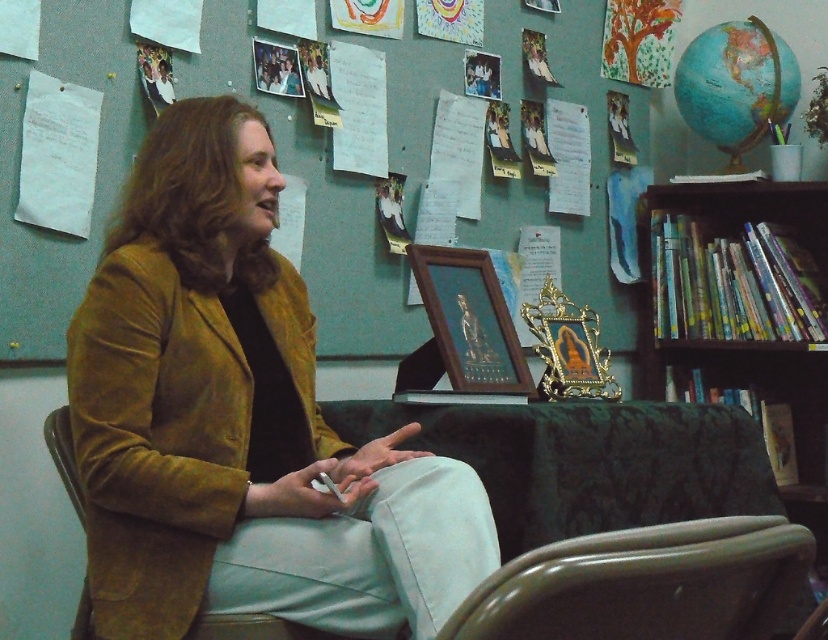
Looking at this image, who is more distant from viewer, (142, 157) or (417, 260)?

The point (417, 260) is more distant.

Find the location of a particular element. The image size is (828, 640). brown silky hair at upper left is located at coordinates point(185,186).

The width and height of the screenshot is (828, 640). What do you see at coordinates (239, 420) in the screenshot?
I see `velvet mustard jacket at center` at bounding box center [239, 420].

Which is more to the right, velvet mustard jacket at center or dark wood bookshelf at right?

dark wood bookshelf at right

You are a GUI agent. You are given a task and a screenshot of the screen. Output one action in this format:
    pyautogui.click(x=<x>, y=<y>)
    Task: Click on the velvet mustard jacket at center
    This screenshot has height=640, width=828.
    Given the screenshot: What is the action you would take?
    pyautogui.click(x=239, y=420)

Does leather-like beige swivel chair at lower right come behind brown silky hair at upper left?

No, leather-like beige swivel chair at lower right is closer to the viewer.

Does leather-like beige swivel chair at lower right appear over brown silky hair at upper left?

No.

Where is `leather-like beige swivel chair at lower right`? leather-like beige swivel chair at lower right is located at coordinates (644, 584).

This screenshot has height=640, width=828. Find the location of `leather-like beige swivel chair at lower right`. leather-like beige swivel chair at lower right is located at coordinates (644, 584).